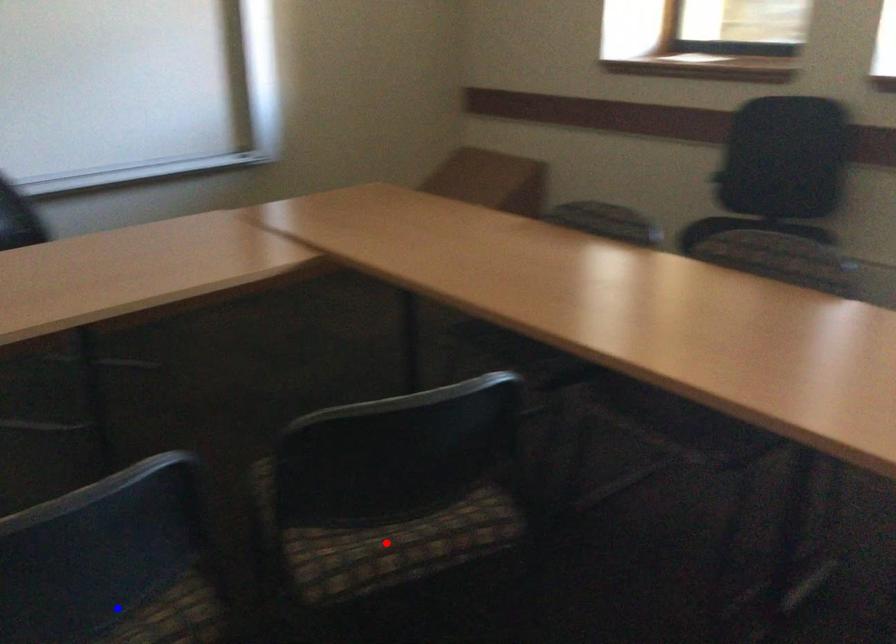
Question: Two points are marked on the image. Which point is closer to the camera?

Choices:
 (A) Blue point is closer.
 (B) Red point is closer.

Answer: (A)